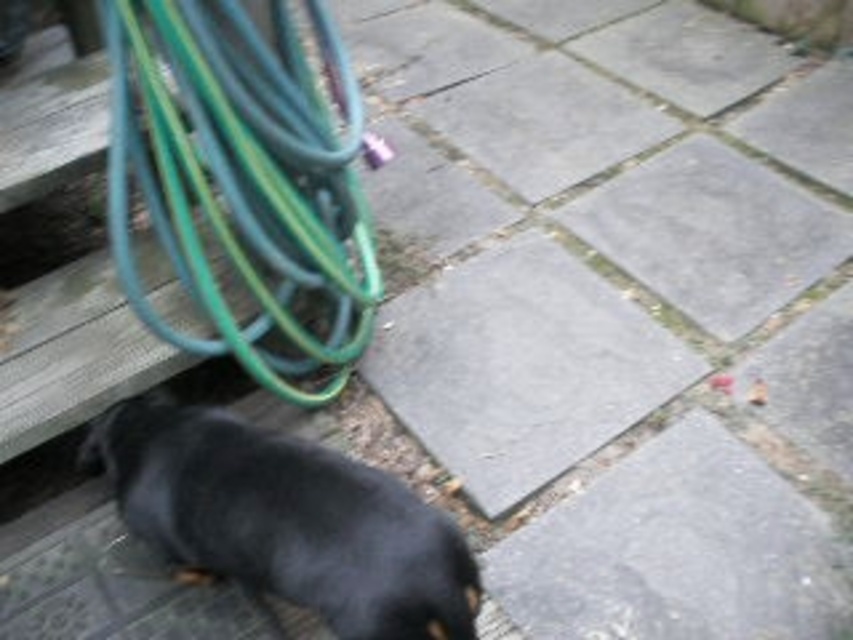
Is green rubber hose at upper left above black smooth dog at lower left?

Yes, green rubber hose at upper left is above black smooth dog at lower left.

Between green rubber hose at upper left and black smooth dog at lower left, which one appears on the left side from the viewer's perspective?

green rubber hose at upper left is more to the left.

What do you see at coordinates (242, 177) in the screenshot? Image resolution: width=853 pixels, height=640 pixels. I see `green rubber hose at upper left` at bounding box center [242, 177].

I want to click on green rubber hose at upper left, so click(242, 177).